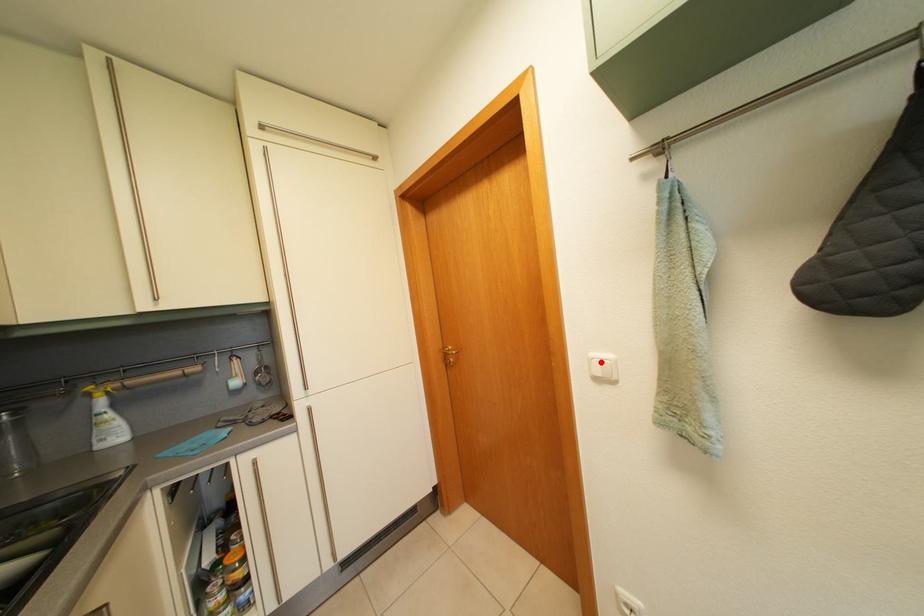
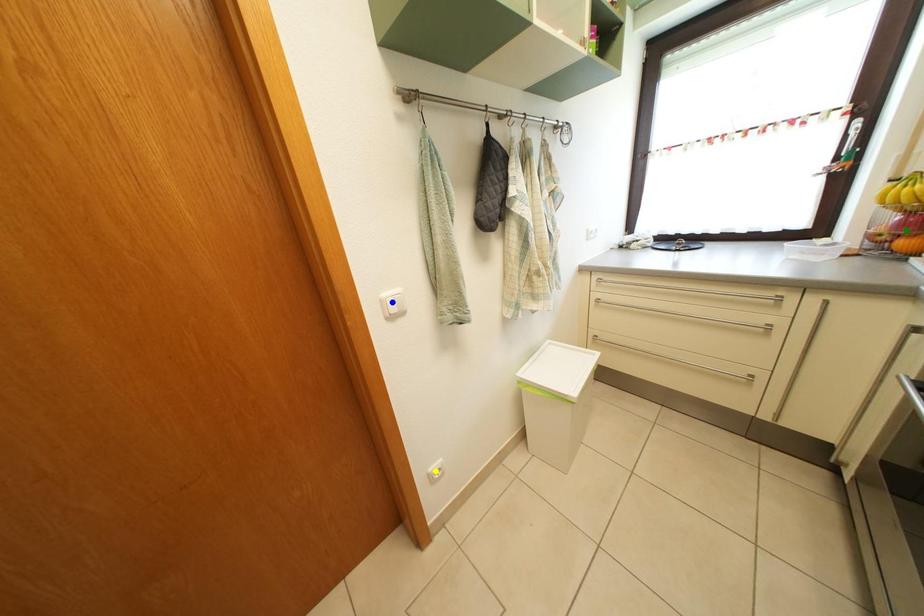
Question: I am providing you with two images of the same scene from different viewpoints. A red point is marked on the first image. You are given multiple points on the second image. Can you choose the point in image 2 that corresponds to the point in image 1?

Choices:
 (A) green point
 (B) yellow point
 (C) blue point

Answer: (C)